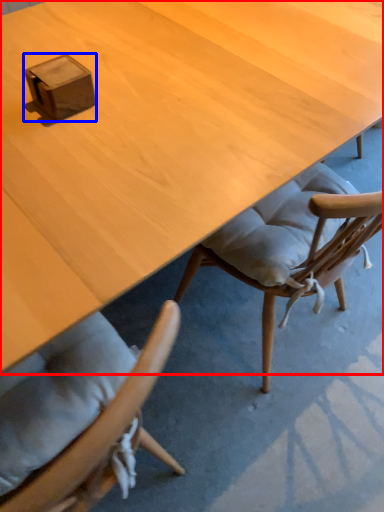
Question: Which point is closer to the camera, desk (highlighted by a red box) or box (highlighted by a blue box)?

Choices:
 (A) desk
 (B) box

Answer: (A)